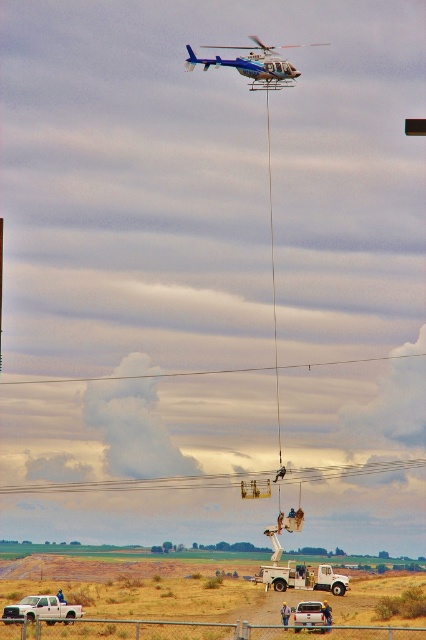
Question: Among these objects, which one is farthest from the camera?

Choices:
 (A) white matte truck at lower left
 (B) blue metallic helicopter at upper center
 (C) white matte truck at lower center

Answer: (B)

Question: Which of these objects is positioned closest to the white matte truck at lower center?

Choices:
 (A) white matte truck at lower left
 (B) blue metallic helicopter at upper center

Answer: (A)

Question: Which of the following is the closest to the observer?

Choices:
 (A) white matte truck at lower center
 (B) white matte truck at lower left

Answer: (B)

Question: Does blue metallic helicopter at upper center have a larger size compared to white matte truck at lower left?

Choices:
 (A) no
 (B) yes

Answer: (B)

Question: In this image, where is blue metallic helicopter at upper center located relative to white matte truck at lower left?

Choices:
 (A) right
 (B) left

Answer: (A)

Question: Is blue metallic helicopter at upper center positioned behind white matte truck at lower left?

Choices:
 (A) yes
 (B) no

Answer: (A)